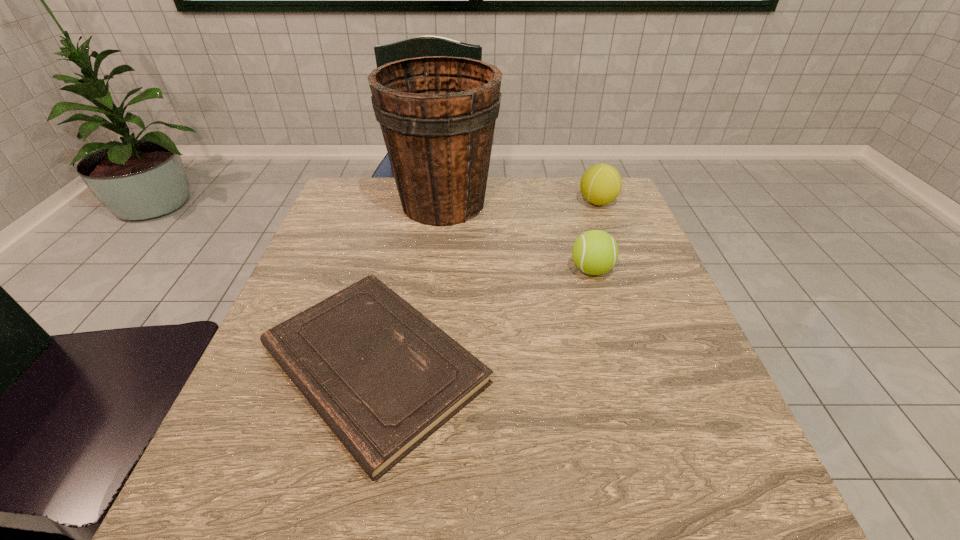
Identify the location of the tallest object. The width and height of the screenshot is (960, 540). (437, 114).

This screenshot has width=960, height=540. Find the location of `the farther tennis ball`. the farther tennis ball is located at coordinates (600, 184).

Find the location of a particular element. This screenshot has width=960, height=540. the nearer tennis ball is located at coordinates (595, 252).

Where is `the shortest object`? The width and height of the screenshot is (960, 540). the shortest object is located at coordinates (383, 377).

Locate an element on the screen. Image resolution: width=960 pixels, height=540 pixels. paperback book is located at coordinates (383, 377).

Identify the location of vacant space located 0.210m on the front of the bucket. Image resolution: width=960 pixels, height=540 pixels. (433, 293).

Find the location of a particular element. This screenshot has height=540, width=960. vacant space located 0.240m on the left of the farther tennis ball is located at coordinates (491, 202).

Find the location of a particular element. This screenshot has height=540, width=960. vacant space situated 0.120m on the front of the second nearest object is located at coordinates (608, 325).

The width and height of the screenshot is (960, 540). I want to click on vacant space situated 0.130m on the right of the shortest object, so click(x=564, y=365).

You are a GUI agent. You are given a task and a screenshot of the screen. Output one action in this format:
    pyautogui.click(x=<x>, y=<y>)
    Task: Click on the bucket present at the far edge
    This screenshot has width=960, height=540.
    Given the screenshot: What is the action you would take?
    pyautogui.click(x=437, y=114)